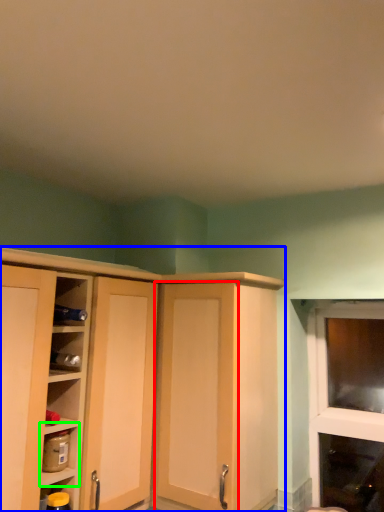
Question: Which object is positioned farthest from screen door (highlighted by a red box)? Select from cupboard (highlighted by a blue box) and shelf (highlighted by a green box).

Choices:
 (A) cupboard
 (B) shelf

Answer: (B)